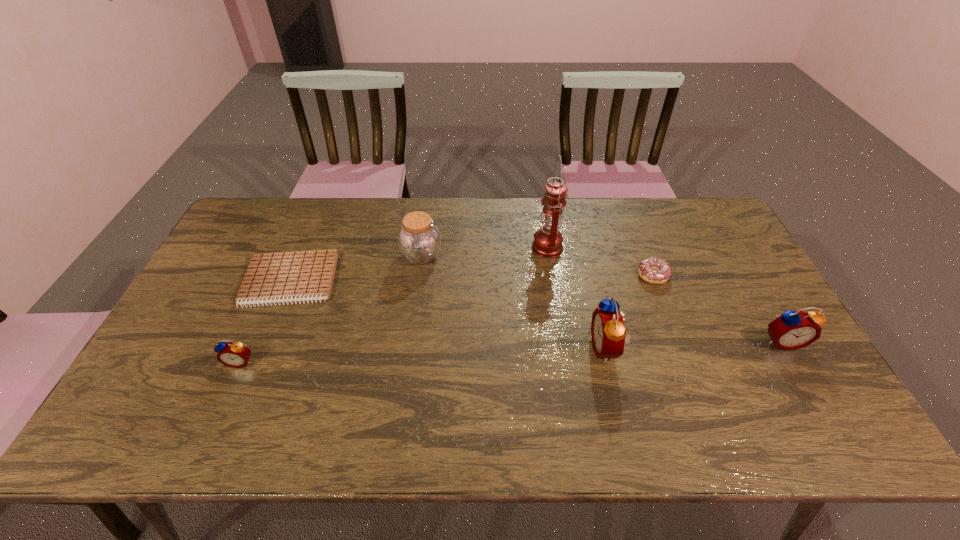
The height and width of the screenshot is (540, 960). I want to click on jar that is at the far edge, so click(x=419, y=240).

What are the coordinates of `object located at the left edge` in the screenshot? It's located at (279, 277).

Locate an element on the screen. object present at the right edge is located at coordinates (791, 330).

This screenshot has width=960, height=540. What are the coordinates of `free spot at the far edge of the desktop` in the screenshot? It's located at (523, 227).

Where is `free point at the near edge`? Image resolution: width=960 pixels, height=540 pixels. free point at the near edge is located at coordinates (296, 372).

Image resolution: width=960 pixels, height=540 pixels. In the image, there is a desktop. Identify the location of free space at the left edge. (169, 369).

Locate an element on the screen. This screenshot has width=960, height=540. vacant space at the near left corner of the desktop is located at coordinates (138, 393).

Locate an element on the screen. free point at the far right corner is located at coordinates (715, 220).

The height and width of the screenshot is (540, 960). I want to click on free spot between the jar and the tallest object, so click(485, 251).

The height and width of the screenshot is (540, 960). I want to click on vacant area that lies between the third object from right to left and the tallest object, so click(x=577, y=297).